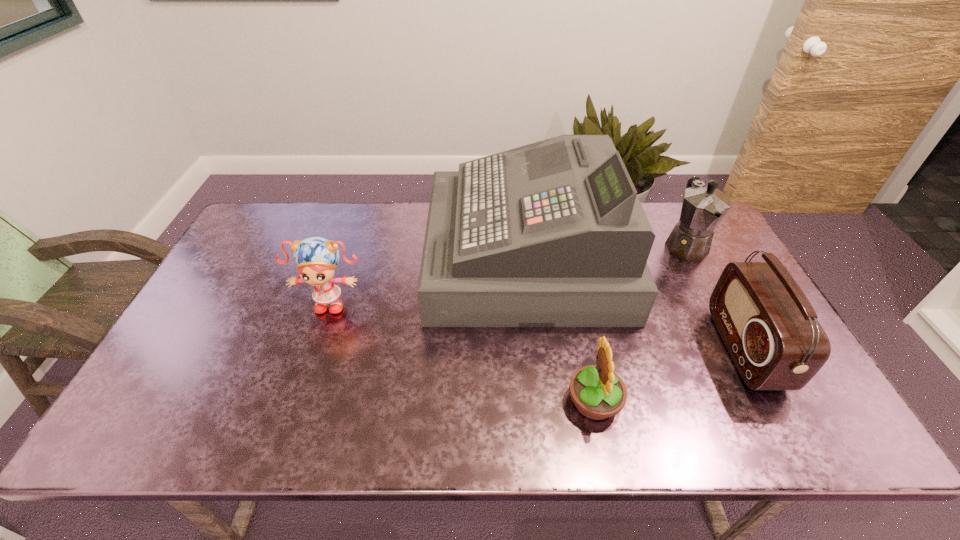
The width and height of the screenshot is (960, 540). What are the coordinates of `free space located 0.170m on the front panel of the radio receiver` in the screenshot? It's located at (660, 348).

Where is `vacant point located on the front panel of the radio receiver`? vacant point located on the front panel of the radio receiver is located at coordinates (694, 348).

Locate an element on the screen. This screenshot has width=960, height=540. vacant region located on the face of the doll is located at coordinates (283, 444).

You are a GUI agent. You are given a task and a screenshot of the screen. Output one action in this format:
    pyautogui.click(x=<x>, y=<y>)
    Task: Click on the vacant space located 0.350m on the face of the sunflower
    
    Given the screenshot: What is the action you would take?
    pyautogui.click(x=417, y=401)

This screenshot has width=960, height=540. I want to click on free space located on the face of the sunflower, so click(399, 401).

Image resolution: width=960 pixels, height=540 pixels. In order to click on free location located 0.330m on the face of the sunflower in this screenshot , I will do `click(425, 401)`.

The width and height of the screenshot is (960, 540). Identify the location of cash register located in the far edge section of the desktop. (551, 234).

Locate an element on the screen. The height and width of the screenshot is (540, 960). coffeepot that is positioned at the far edge is located at coordinates (703, 208).

At what (x,y) coordinates should I click in order to perform the action: click on object that is positioned at the near edge. Please return your answer as a coordinate pair (x, y). This screenshot has width=960, height=540. Looking at the image, I should click on (598, 393).

Locate an element on the screen. coffeepot present at the right edge is located at coordinates (703, 208).